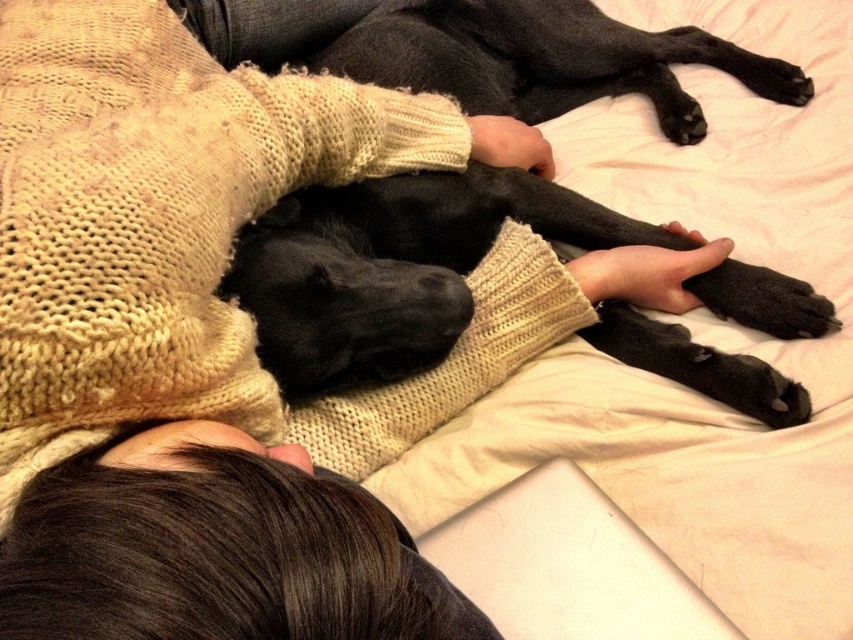
You are designing a new pet bed that needs to accommodate both the black smooth dog at center and the brown knitted sweater at upper center. Based on the scene, which object requires a larger space in terms of width?

The black smooth dog at center requires a larger space in terms of width because its width is larger than the brown knitted sweater at upper center.

You are navigating a small drone through the room where the person and black dog are resting. The drone must fly from point A to point B. Point A is at coordinate point(454, 58) and point B is at coordinate point(79, 625). Which point is closer to the drone when it is at the starting position?

Point A at coordinate point(454, 58) is closer to the drone at the starting position because it is further to the viewer than point B at coordinate point(79, 625).

In the scene shown: You are a delivery robot entering a room and need to place a package on the bed without disturbing the black smooth dog at center. Based on the coordinates provided, where should you place the package relative to the dog?

The black smooth dog at center is located at point (393, 268). To avoid disturbing the dog, place the package in an area away from its position, such as near the edge of the bed opposite to the dog.